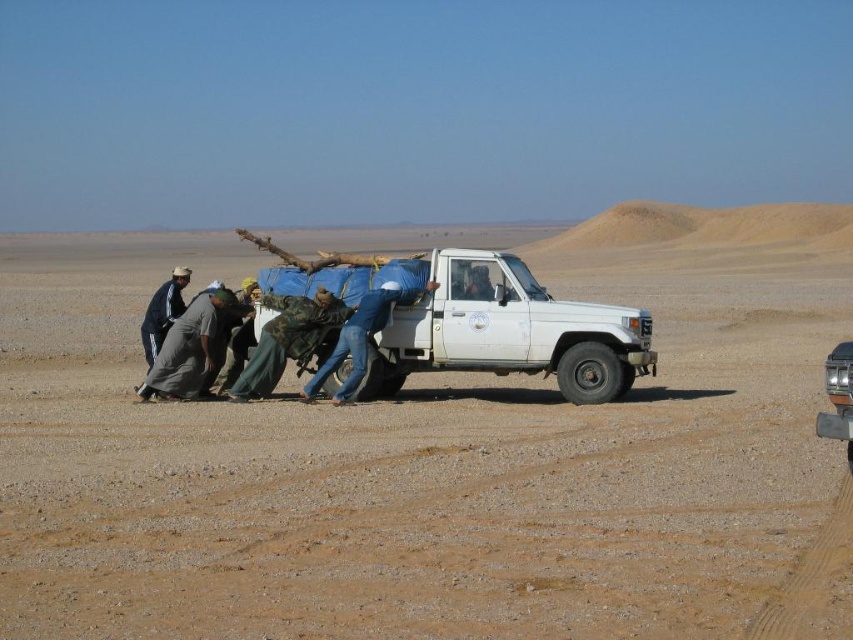
You are a traveler stranded in the desert and need to cross the brown sandy dirt at center. The white matte truck at center is blocking your path. Can you go around the truck to reach the other side of the sandy dirt?

The brown sandy dirt at center is above the white matte truck at center, so the truck is under the sandy dirt. This means the truck is buried or submerged, making it impossible to go around it to reach the other side of the sandy dirt.